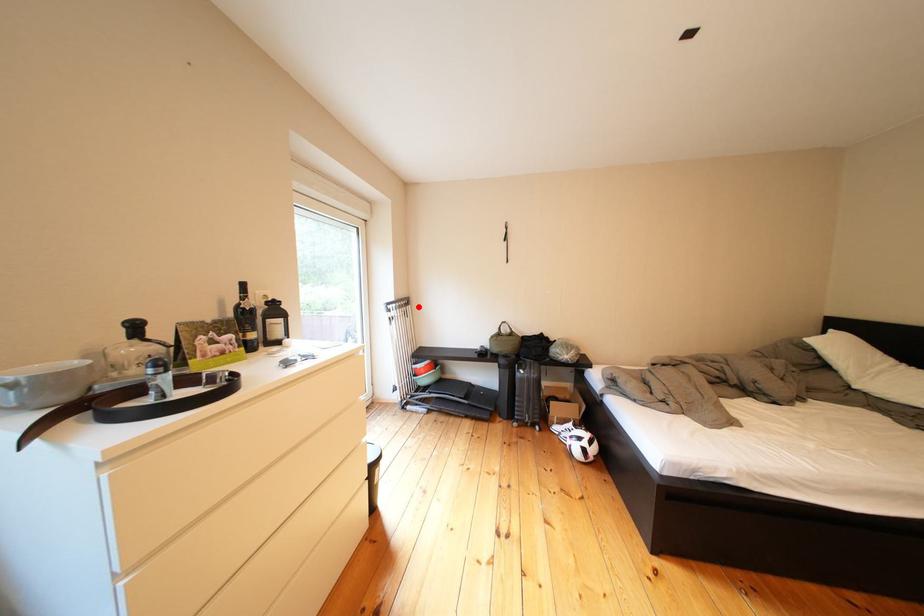
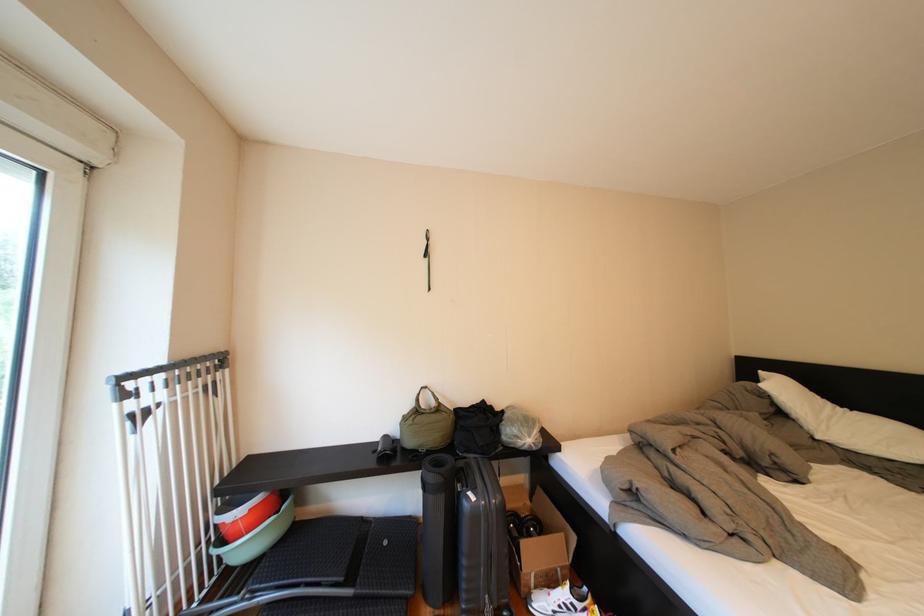
The point at the highlighted location is marked in the first image. Where is the corresponding point in the second image?

(224, 369)